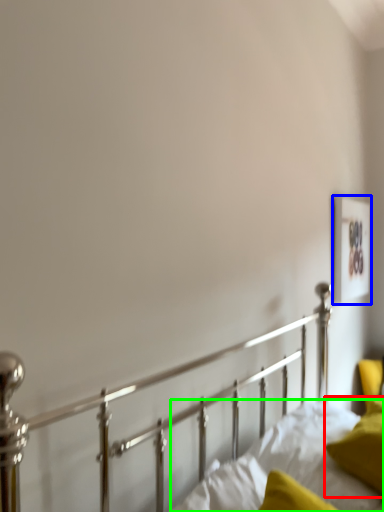
Question: Which is farther away from pillow (highlighted by a red box)? picture frame (highlighted by a blue box) or mattress (highlighted by a green box)?

Choices:
 (A) picture frame
 (B) mattress

Answer: (A)